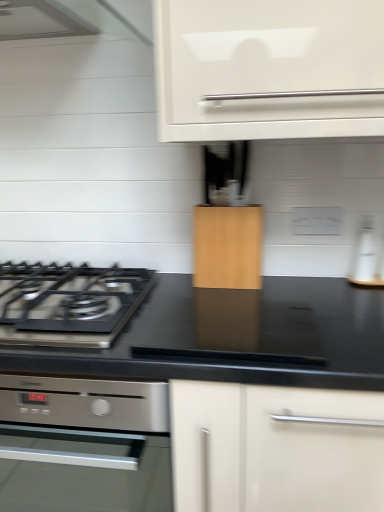
Question: From the image's perspective, is black matte gas stove at left located above or below satin silver oven at lower left?

Choices:
 (A) above
 (B) below

Answer: (A)

Question: Based on their positions, is black matte gas stove at left located to the left or right of satin silver oven at lower left?

Choices:
 (A) left
 (B) right

Answer: (A)

Question: Which is farther from the wooden cabinet at center?

Choices:
 (A) black matte gas stove at left
 (B) white glossy bottle at right
 (C) satin silver oven at lower left

Answer: (C)

Question: Estimate the real-world distances between objects in this image. Which object is farther from the satin silver oven at lower left?

Choices:
 (A) wooden cabinet at center
 (B) black matte gas stove at left
 (C) white glossy bottle at right

Answer: (C)